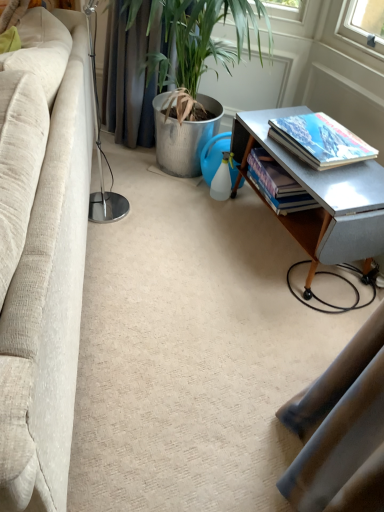
Question: Is hardcover book at right, acting as the second book starting from the back, next to hardcover book at right, the 2th book viewed from the front?

Choices:
 (A) no
 (B) yes

Answer: (A)

Question: Can you confirm if hardcover book at right, the first book positioned from the front, is shorter than hardcover book at right, the 2th book viewed from the front?

Choices:
 (A) yes
 (B) no

Answer: (A)

Question: Is hardcover book at right, the first book positioned from the front, thinner than hardcover book at right, which appears as the 1th book when viewed from the back?

Choices:
 (A) no
 (B) yes

Answer: (A)

Question: Is hardcover book at right, the first book positioned from the front, outside hardcover book at right, which appears as the 1th book when viewed from the back?

Choices:
 (A) yes
 (B) no

Answer: (A)

Question: Does hardcover book at right, acting as the second book starting from the back, appear on the right side of hardcover book at right, the 2th book viewed from the front?

Choices:
 (A) yes
 (B) no

Answer: (A)

Question: From the image's perspective, is metallic gray table at right positioned above or below beige fabric couch at left?

Choices:
 (A) above
 (B) below

Answer: (A)

Question: Based on their sizes in the image, would you say metallic gray table at right is bigger or smaller than beige fabric couch at left?

Choices:
 (A) big
 (B) small

Answer: (B)

Question: Considering their positions, is metallic gray table at right located in front of or behind beige fabric couch at left?

Choices:
 (A) behind
 (B) front

Answer: (A)

Question: From a real-world perspective, relative to beige fabric couch at left, is metallic gray table at right vertically above or below?

Choices:
 (A) above
 (B) below

Answer: (B)

Question: From a real-world perspective, is hardcover book at right, the first book positioned from the front, above or below metallic gray table at right?

Choices:
 (A) above
 (B) below

Answer: (A)

Question: Is point (311, 157) positioned closer to the camera than point (370, 257)?

Choices:
 (A) closer
 (B) farther

Answer: (B)

Question: Is hardcover book at right, the first book positioned from the front, to the left or to the right of metallic gray table at right in the image?

Choices:
 (A) right
 (B) left

Answer: (A)

Question: Looking at the image, does hardcover book at right, the first book positioned from the front, seem bigger or smaller compared to metallic gray table at right?

Choices:
 (A) big
 (B) small

Answer: (B)

Question: Is point (26, 31) closer or farther from the camera than point (291, 198)?

Choices:
 (A) farther
 (B) closer

Answer: (B)

Question: Which is correct: beige fabric couch at left is inside hardcover book at right, which appears as the 1th book when viewed from the back, or outside of it?

Choices:
 (A) outside
 (B) inside

Answer: (A)